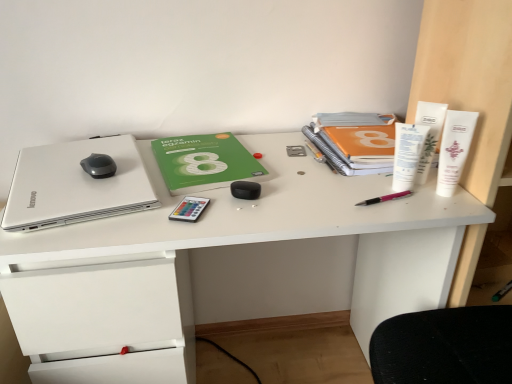
Where is `vacant space that's between black plastic remote control at center-left, the 1th stationery in the left-to-right sequence, and pink metallic pen at center-right, which is the second stationery in left-to-right order`? vacant space that's between black plastic remote control at center-left, the 1th stationery in the left-to-right sequence, and pink metallic pen at center-right, which is the second stationery in left-to-right order is located at coordinates click(x=283, y=205).